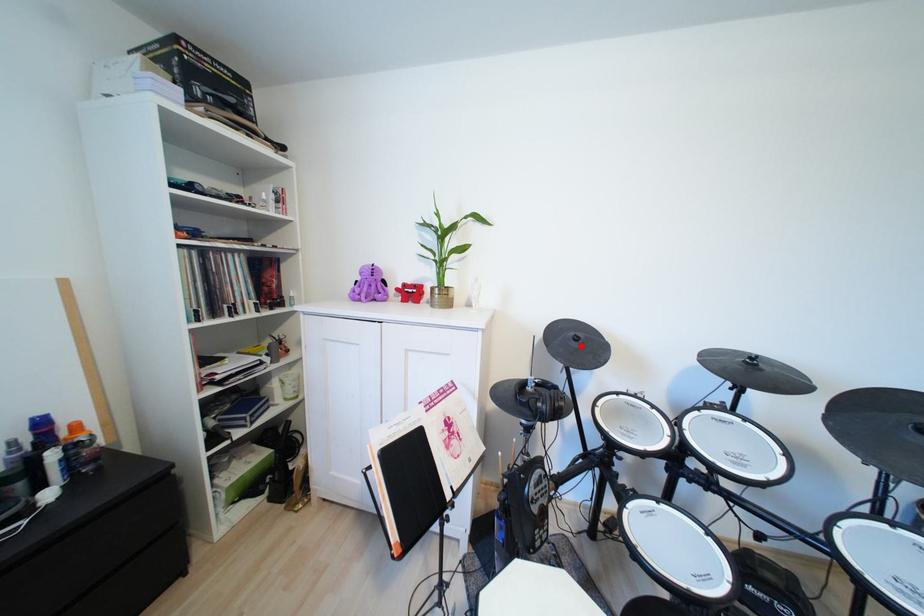
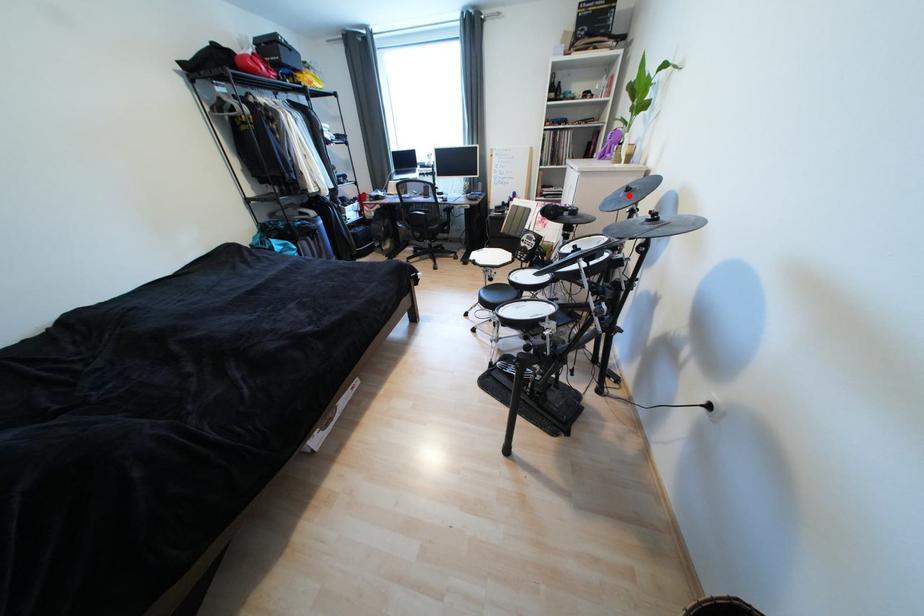
I am providing you with two images of the same scene from different viewpoints. A red point is marked on the first image and another point is marked on the second image. Does the point marked in image1 correspond to the same location as the one in image2?

Yes